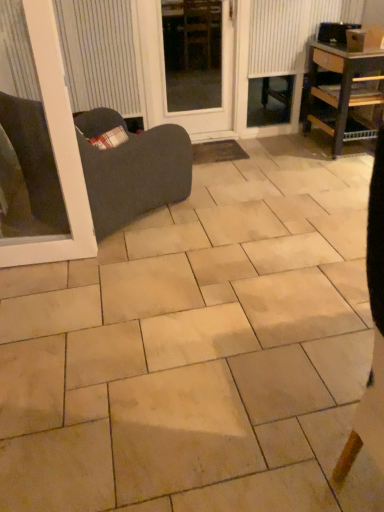
Describe the element at coordinates (290, 31) in the screenshot. I see `white textured radiator at upper right` at that location.

Measure the distance between point (182, 6) and camera.

Point (182, 6) is 3.62 meters from camera.

Find the location of a particular element. The width and height of the screenshot is (384, 512). white textured radiator at upper right is located at coordinates (290, 31).

Considering the relative positions of beige ceramic tile at center and transparent glass door at center in the image provided, is beige ceramic tile at center to the left or to the right of transparent glass door at center?

Based on their positions, beige ceramic tile at center is located to the right of transparent glass door at center.

Considering the relative sizes of beige ceramic tile at center and transparent glass door at center in the image provided, is beige ceramic tile at center wider than transparent glass door at center?

Yes, beige ceramic tile at center is wider than transparent glass door at center.

From a real-world perspective, is beige ceramic tile at center physically below transparent glass door at center?

Yes, from a real-world perspective, beige ceramic tile at center is below transparent glass door at center.

From a real-world perspective, is white textured radiator at upper right above or below beige ceramic tile at center?

From a real-world perspective, white textured radiator at upper right is physically above beige ceramic tile at center.

Is white textured radiator at upper right spatially inside beige ceramic tile at center, or outside of it?

The correct answer is: outside.

Based on the photo, between white textured radiator at upper right and beige ceramic tile at center, which one appears on the right side from the viewer's perspective?

Positioned to the right is white textured radiator at upper right.

Considering the relative sizes of white textured radiator at upper right and beige ceramic tile at center in the image provided, is white textured radiator at upper right taller than beige ceramic tile at center?

Yes.

Is brown woven mat at center at the right side of white textured radiator at upper right?

No.

At what (x,y) coordinates should I click in order to perform the action: click on radiator lying on the right of brown woven mat at center. Please return your answer as a coordinate pair (x, y). Looking at the image, I should click on (290, 31).

Is brown woven mat at center taller or shorter than white textured radiator at upper right?

Considering their sizes, brown woven mat at center has less height than white textured radiator at upper right.

Consider the image. Choose the correct answer: Is brown woven mat at center inside wooden shelf at right or outside it?

brown woven mat at center is outside wooden shelf at right.

Is point (236, 159) farther from camera compared to point (320, 96)?

Yes, it is.

Based on the photo, considering the sizes of objects brown woven mat at center and wooden shelf at right in the image provided, who is smaller, brown woven mat at center or wooden shelf at right?

Smaller between the two is brown woven mat at center.

How far apart are brown woven mat at center and wooden shelf at right?

brown woven mat at center and wooden shelf at right are 37.96 inches apart.

Is point (270, 39) closer to viewer compared to point (201, 48)?

That is True.

From the picture: Between white textured radiator at upper right and transparent glass door at center, which one is positioned in front?

transparent glass door at center is closer to the camera.

Can you confirm if white textured radiator at upper right is shorter than transparent glass door at center?

Yes, white textured radiator at upper right is shorter than transparent glass door at center.

Considering the sizes of objects white textured radiator at upper right and transparent glass door at center in the image provided, who is wider, white textured radiator at upper right or transparent glass door at center?

Wider between the two is white textured radiator at upper right.

Based on the photo, considering their positions, is transparent glass door at center located in front of or behind white textured radiator at upper right?

Visually, transparent glass door at center is located in front of white textured radiator at upper right.

Which is more to the left, transparent glass door at center or white textured radiator at upper right?

transparent glass door at center is more to the left.

Is transparent glass door at center bigger or smaller than white textured radiator at upper right?

In the image, transparent glass door at center appears to be larger than white textured radiator at upper right.

From the picture: Is transparent glass door at center next to white textured radiator at upper right?

They are not placed beside each other.

Is white textured radiator at upper right taller than matte white blind at upper left?

In fact, white textured radiator at upper right may be shorter than matte white blind at upper left.

Between white textured radiator at upper right and matte white blind at upper left, which one is positioned behind?

white textured radiator at upper right is more distant.

From a real-world perspective, which object rests below the other?

matte white blind at upper left is physically lower.

Looking at this image, is white textured radiator at upper right to the left or to the right of matte white blind at upper left in the image?

Based on their positions, white textured radiator at upper right is located to the right of matte white blind at upper left.

You are a GUI agent. You are given a task and a screenshot of the screen. Output one action in this format:
    pyautogui.click(x=<x>, y=<y>)
    Task: Click on the ceramic tile on the right of transparent glass door at center
    The image size is (384, 512).
    Given the screenshot: What is the action you would take?
    pyautogui.click(x=198, y=349)

You are a GUI agent. You are given a task and a screenshot of the screen. Output one action in this format:
    pyautogui.click(x=<x>, y=<y>)
    Task: Click on the radiator behind the beige ceramic tile at center
    The image size is (384, 512).
    Given the screenshot: What is the action you would take?
    pyautogui.click(x=290, y=31)

Looking at the image, which one is located further to wooden shelf at right, matte white blind at upper left or white textured radiator at upper right?

The object further to wooden shelf at right is matte white blind at upper left.

Estimate the real-world distances between objects in this image. Which object is further from brown woven mat at center, beige ceramic tile at center or wooden shelf at right?

beige ceramic tile at center is further to brown woven mat at center.

Which object lies nearer to the anchor point white textured radiator at upper right, matte white blind at upper left or beige ceramic tile at center?

matte white blind at upper left is closer to white textured radiator at upper right.

From the image, which object appears to be farther from wooden shelf at right, brown woven mat at center or matte white blind at upper left?

matte white blind at upper left lies further to wooden shelf at right than the other object.

Based on their spatial positions, is matte white blind at upper left or transparent glass door at center further from brown woven mat at center?

matte white blind at upper left lies further to brown woven mat at center than the other object.

Estimate the real-world distances between objects in this image. Which object is closer to brown woven mat at center, beige ceramic tile at center or matte white blind at upper left?

matte white blind at upper left.

From the image, which object appears to be nearer to wooden shelf at right, matte white blind at upper left or transparent glass door at center?

The object closer to wooden shelf at right is transparent glass door at center.

From the image, which object appears to be nearer to transparent glass door at center, brown woven mat at center or white textured radiator at upper right?

white textured radiator at upper right.

Where is `table positioned between beige ceramic tile at center and brown woven mat at center from near to far`? The height and width of the screenshot is (512, 384). table positioned between beige ceramic tile at center and brown woven mat at center from near to far is located at coordinates pos(344,91).

Find the location of a particular element. This screenshot has width=384, height=512. window screen situated between matte white blind at upper left and wooden shelf at right from left to right is located at coordinates (192, 53).

Find the location of `window screen located between beige ceramic tile at center and brown woven mat at center in the depth direction`. window screen located between beige ceramic tile at center and brown woven mat at center in the depth direction is located at coordinates (192, 53).

The width and height of the screenshot is (384, 512). Identify the location of doormat between transparent glass door at center and white textured radiator at upper right from left to right. (217, 152).